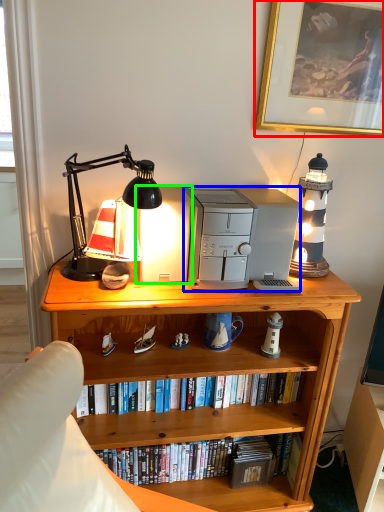
Question: Which object is positioned closest to picture frame (highlighted by a red box)? Select from appliance (highlighted by a blue box) and appliance (highlighted by a green box).

Choices:
 (A) appliance
 (B) appliance

Answer: (A)